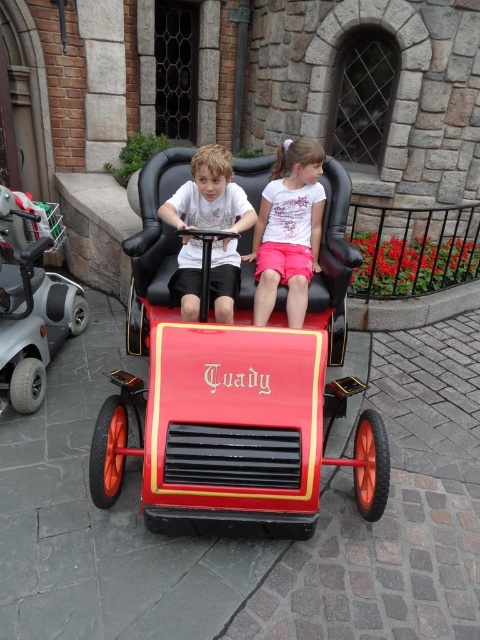
You are standing at the position where the image was taken. There is a metallic silver scooter at lower left. If you want to pick up the scooter, how many steps would you need to take to reach it?

The metallic silver scooter at lower left is 2.85 meters from viewer, so you would need to take approximately 3 to 4 steps to reach it, assuming an average step length of about 0.7 to 0.9 meters per step.

You are a photographer taking a picture of the shiny red toy car at center and the pink cotton shorts at center. To ensure both are in the frame, should you adjust your camera to the left or right?

The shiny red toy car at center is to the left of the pink cotton shorts at center, so you should adjust your camera to the right to ensure both are in the frame.

You are a photographer trying to capture a photo of the shiny red toy car at center and the pink cotton shorts at center. Since you want to ensure both are clearly visible, which object should you focus on first to account for their sizes?

The shiny red toy car at center is bigger than pink cotton shorts at center, so you should focus on the shiny red toy car at center first as it occupies more space in the frame, ensuring it is sharp before adjusting for the smaller pink cotton shorts at center.